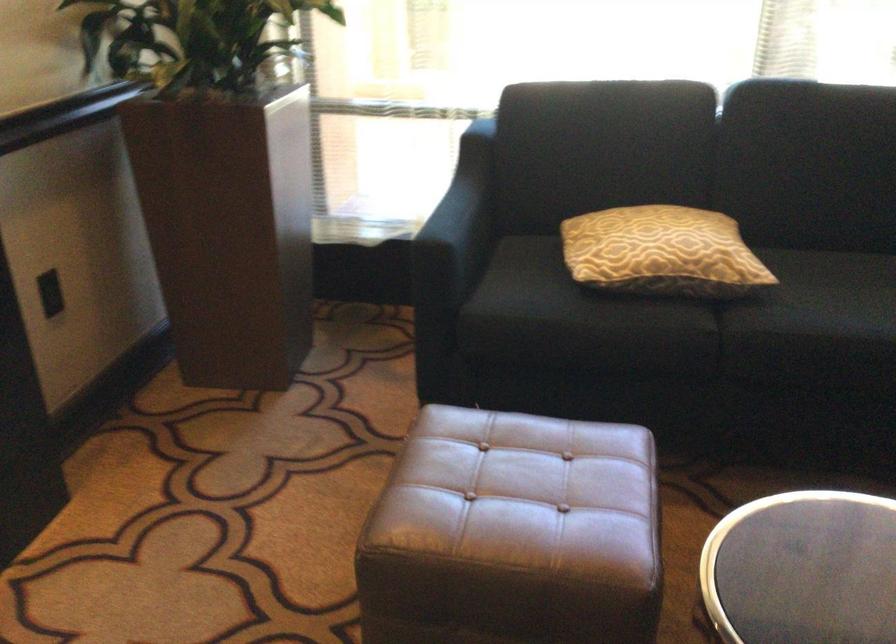
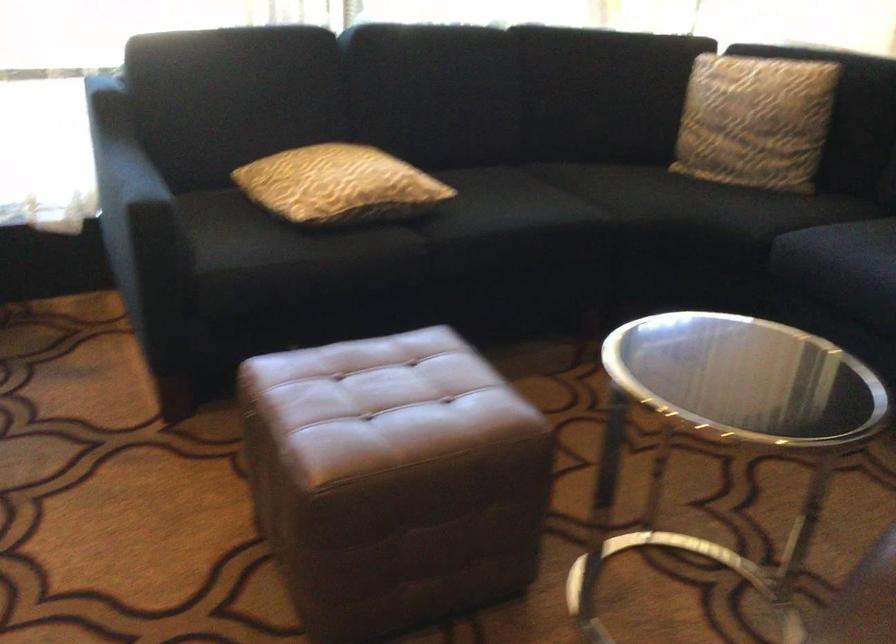
Question: The images are taken continuously from a first-person perspective. In which direction is your viewpoint rotating?

Choices:
 (A) Left
 (B) Right
 (C) Up
 (D) Down

Answer: (B)